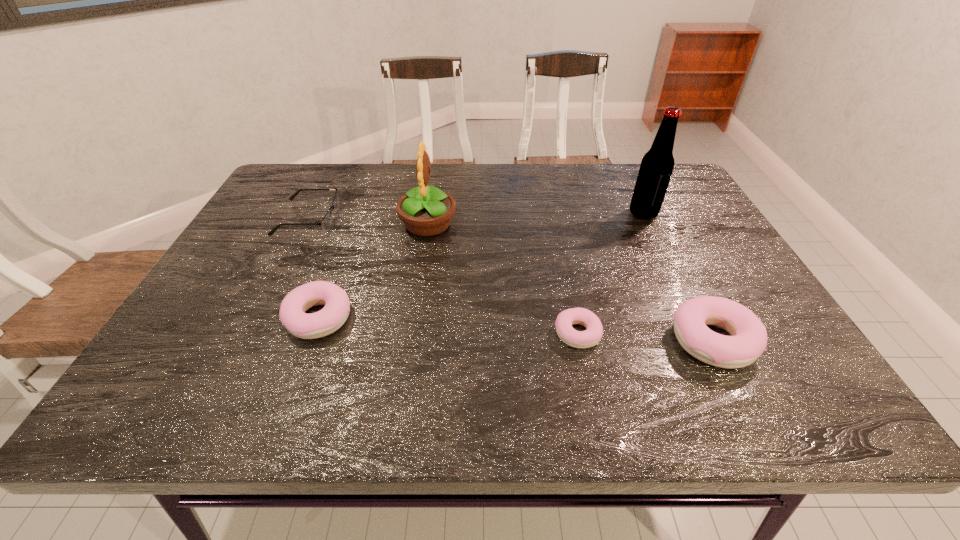
Find the location of a particular element. This screenshot has height=540, width=960. unoccupied area between the second pastry from right to left and the rightmost pastry is located at coordinates (645, 337).

Identify the location of free spot between the tallest object and the second shortest object. This screenshot has height=540, width=960. point(475,215).

What are the coordinates of `free space between the second shortest object and the tallest object` in the screenshot? It's located at (475, 215).

Find the location of a particular element. This screenshot has height=540, width=960. vacant space that is in between the rightmost pastry and the second shortest pastry is located at coordinates (516, 329).

Identify the location of vacant area between the shortest object and the beer bottle. The height and width of the screenshot is (540, 960). (611, 273).

Locate an element on the screen. free space between the second tallest object and the rightmost pastry is located at coordinates (570, 283).

Identify the location of vacant area between the sunflower and the third shortest object. (373, 272).

Locate an element on the screen. Image resolution: width=960 pixels, height=540 pixels. object identified as the second closest to the spectacles is located at coordinates pos(292,314).

Locate which object ranks fifth in proximity to the rightmost pastry. Please provide its 2D coordinates. Your answer should be formatted as a tuple, i.e. [(x, y)], where the tuple contains the x and y coordinates of a point satisfying the conditions above.

[(326, 222)]

Locate which pastry is the closest to the second shortest object. Please provide its 2D coordinates. Your answer should be formatted as a tuple, i.e. [(x, y)], where the tuple contains the x and y coordinates of a point satisfying the conditions above.

[(292, 314)]